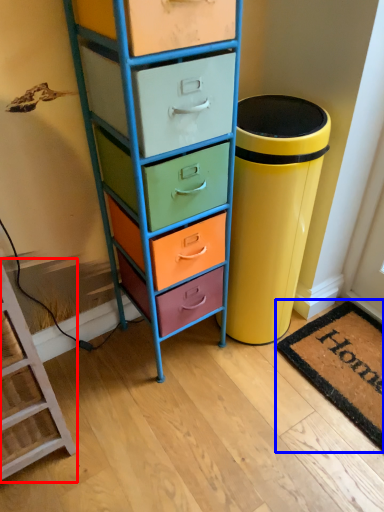
Question: Which object appears farthest to the camera in this image, furniture (highlighted by a red box) or mat (highlighted by a blue box)?

Choices:
 (A) furniture
 (B) mat

Answer: (B)